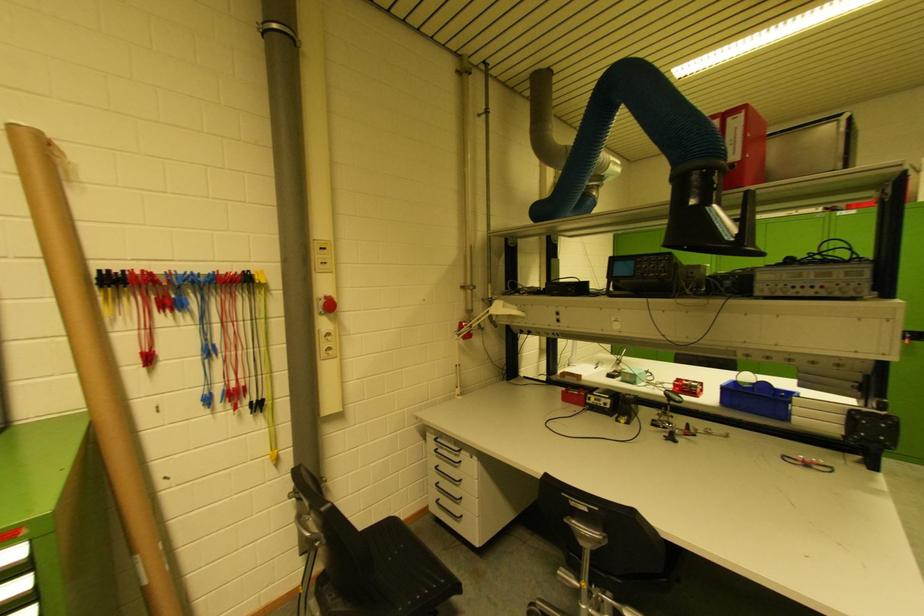
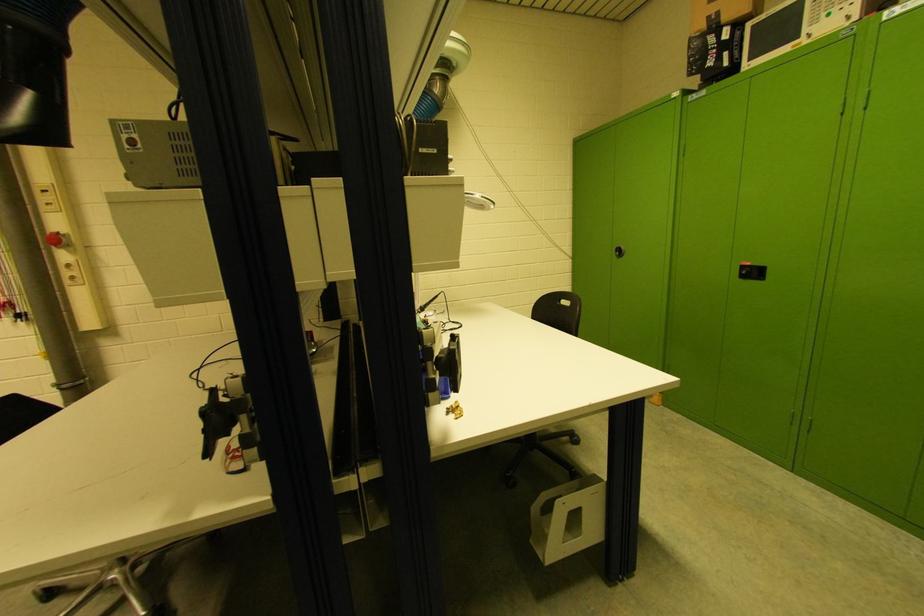
Looking at this image, what movement of the cameraman would produce the second image?

The cameraman moved toward right, forward.